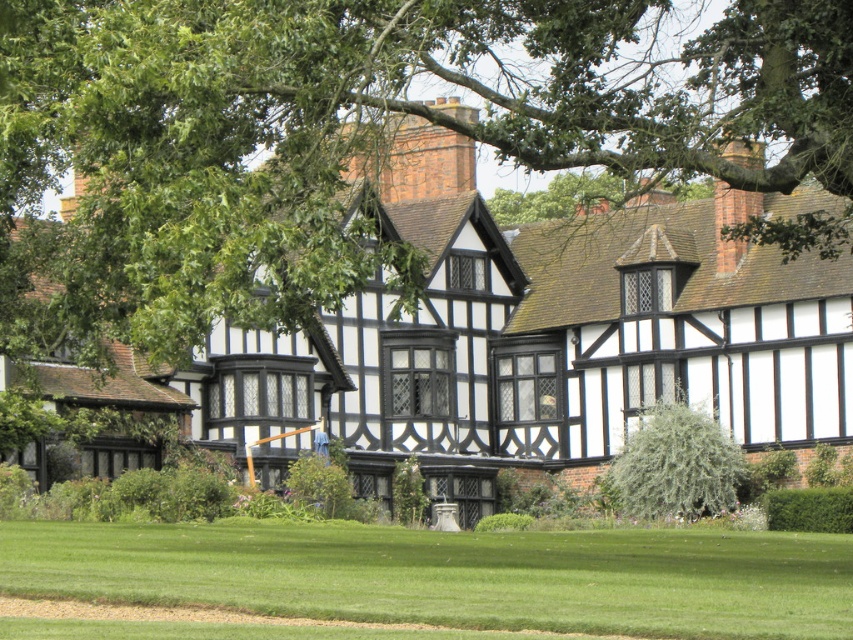
Question: Is green leafy tree at upper center positioned at the back of green grass at lower center?

Choices:
 (A) yes
 (B) no

Answer: (A)

Question: Can you confirm if green leafy tree at upper center is bigger than green grass at lower center?

Choices:
 (A) yes
 (B) no

Answer: (A)

Question: Does green leafy tree at upper center appear over green grass at lower center?

Choices:
 (A) no
 (B) yes

Answer: (B)

Question: Which object appears closest to the camera in this image?

Choices:
 (A) green fuzzy bush at center
 (B) green leafy tree at upper center

Answer: (B)

Question: Which object is the farthest from the green leafy tree at upper center?

Choices:
 (A) green grass at lower center
 (B) green fuzzy bush at center

Answer: (B)

Question: Which object is positioned farthest from the green grass at lower center?

Choices:
 (A) green leafy tree at upper center
 (B) green fuzzy bush at center

Answer: (B)